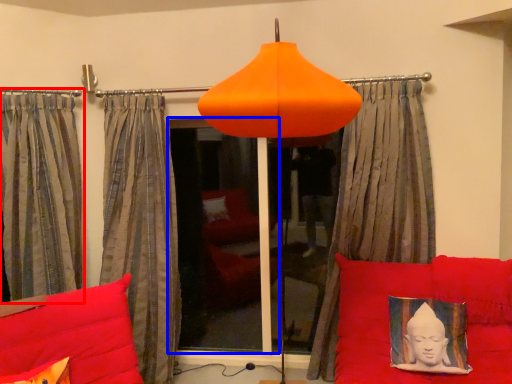
Question: Which point is further to the camera, curtain (highlighted by a red box) or window screen (highlighted by a blue box)?

Choices:
 (A) curtain
 (B) window screen

Answer: (B)